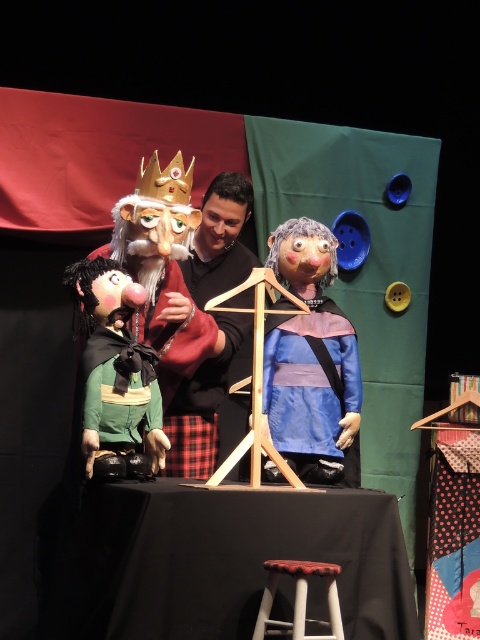
You are a stagehand preparing to adjust the height of the puppets for a performance. The matte green fabric puppet at left and the black matte shirt at center are both on the stage. Which puppet needs to be raised to match the height of the other?

The matte green fabric puppet at left is not as tall as the black matte shirt at center, so the matte green fabric puppet at left needs to be raised to match the height of the black matte shirt at center.

From the picture: You are a puppeteer who needs to sit down to operate the puppets. There is a wooden stool at lower center and a black matte shirt at center. Which object should you move first to sit on the stool?

You should move the black matte shirt at center first because the wooden stool at lower center is behind it, so you need to clear the area in front of the stool to sit down.

You are a photographer trying to capture the two points in the image. Which point, point (x=111, y=408) or point (x=249, y=269), will appear larger in your photo?

Point (x=111, y=408) is closer to the camera than point (x=249, y=269), so it will appear larger in the photo.